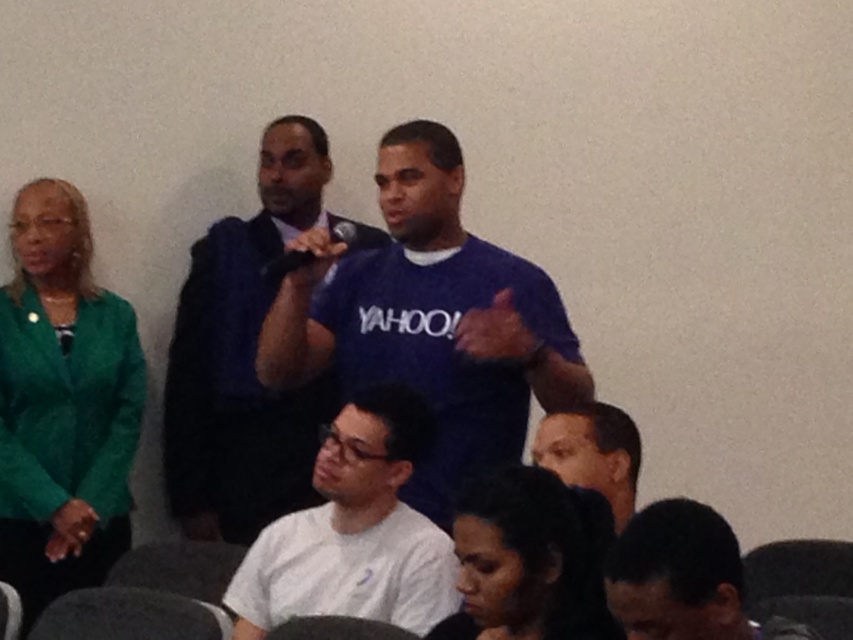
You are standing in the room and need to hand a document to both the matte blue shirt at center and the white matte shirt at lower center. Which person should you approach first if you want to reach the taller one?

The matte blue shirt at center is much taller than the white matte shirt at lower center, so you should approach the matte blue shirt at center first.

You are attending a meeting and need to hand a document to the person wearing the matte blue shirt at center and the dark blue shirt at lower right. Which one can you approach directly without moving past others?

The matte blue shirt at center is closer to you than the dark blue shirt at lower right, so you can approach the matte blue shirt at center directly without needing to move past others.

You are standing in the room and want to move from point A at point (416, 317) to point B at point (340, 509). Which direction should you move to get closer to the camera?

To move closer to the camera, you should move towards point B at point (340, 509) because point A at point (416, 317) is further away from the camera compared to point B.